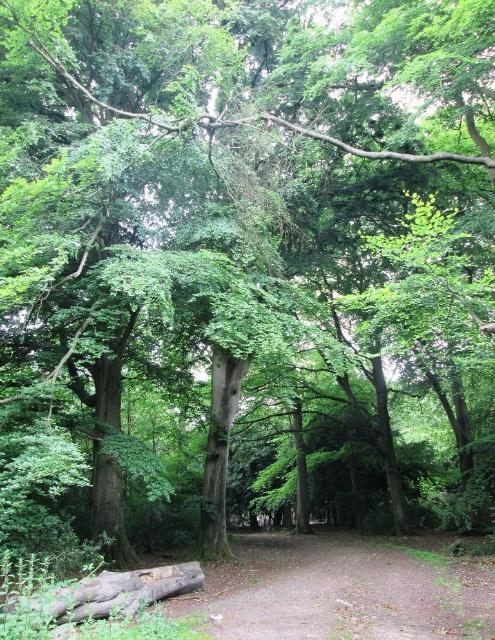
Question: Does dirt/gravel path at center have a larger size compared to brown rough log at lower left?

Choices:
 (A) no
 (B) yes

Answer: (B)

Question: Can you confirm if dirt/gravel path at center is positioned above brown rough log at lower left?

Choices:
 (A) no
 (B) yes

Answer: (A)

Question: Which of the following is the closest to the observer?

Choices:
 (A) (136, 589)
 (B) (404, 621)

Answer: (B)

Question: Which of the following is the closest to the observer?

Choices:
 (A) (230, 595)
 (B) (43, 608)

Answer: (B)

Question: Which point is farther to the camera?

Choices:
 (A) (448, 636)
 (B) (182, 580)

Answer: (B)

Question: Does dirt/gravel path at center have a lesser width compared to brown rough log at lower left?

Choices:
 (A) yes
 (B) no

Answer: (B)